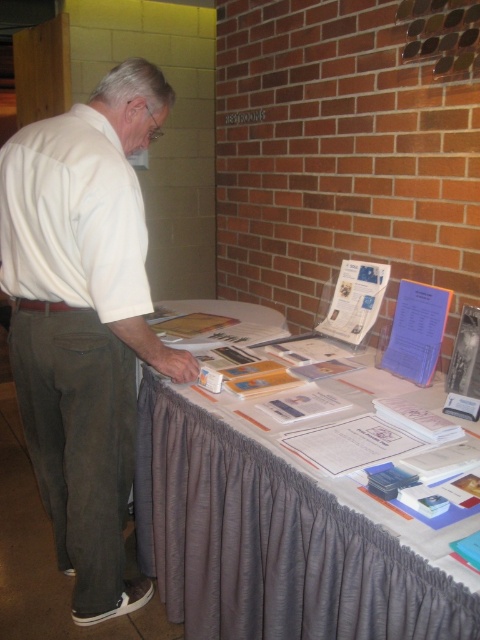
Question: Which object appears closest to the camera in this image?

Choices:
 (A) white matte shirt at left
 (B) white cotton shirt at left

Answer: (A)

Question: Where is gray fabric tablecloth at lower center located in relation to white cotton shirt at left in the image?

Choices:
 (A) left
 (B) right

Answer: (B)

Question: Which of the following is the closest to the observer?

Choices:
 (A) (84, 596)
 (B) (144, 298)

Answer: (B)

Question: Is gray fabric tablecloth at lower center bigger than white cotton shirt at left?

Choices:
 (A) yes
 (B) no

Answer: (A)

Question: Does gray fabric tablecloth at lower center appear over white cotton shirt at left?

Choices:
 (A) yes
 (B) no

Answer: (B)

Question: Which point appears farthest from the camera in this image?

Choices:
 (A) (437, 621)
 (B) (23, 173)
 (C) (134, 172)

Answer: (C)